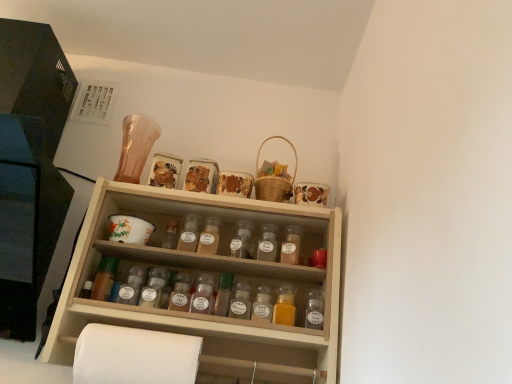
Question: Does point (123, 360) appear closer or farther from the camera than point (266, 139)?

Choices:
 (A) farther
 (B) closer

Answer: (B)

Question: From the image's perspective, is white paper at lower left positioned above or below woven brown basket at upper right?

Choices:
 (A) below
 (B) above

Answer: (A)

Question: Which is nearer to the translucent plastic spice jar at center, which appears as the 7th bottle when viewed from the left?

Choices:
 (A) woven brown basket at upper right
 (B) white paper at lower left
 (C) wooden spice rack at left
 (D) green glass bottle at center, placed as the first bottle when sorted from left to right
 (E) wooden spice rack at center

Answer: (A)

Question: Estimate the real-world distances between objects in this image. Which object is farther from the translucent plastic spice jar at center, which is the 4th bottle from left to right?

Choices:
 (A) translucent plastic bottle at center, acting as the 2th bottle starting from the right
 (B) translucent glass spice jar at center, the third bottle in the right-to-left sequence
 (C) green glass bottle at center, the 7th bottle in the right-to-left sequence
 (D) translucent plastic spice jar at center, positioned as the first bottle in right-to-left order
 (E) translucent glass spice jar at center, which is the sixth bottle in right-to-left order

Answer: (C)